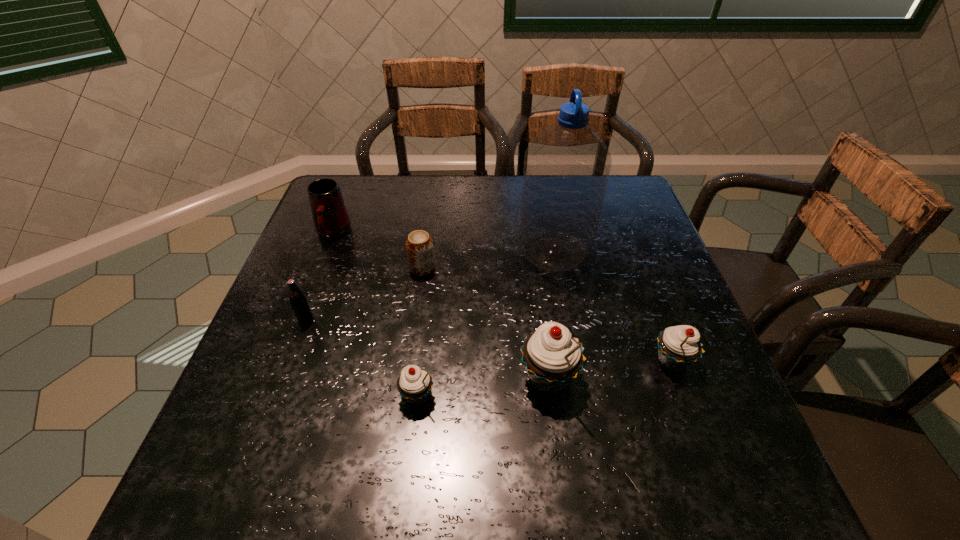
Please point a spot on the left to add another cupcake. Please provide its 2D coordinates. Your answer should be formatted as a tuple, i.e. [(x, y)], where the tuple contains the x and y coordinates of a point satisfying the conditions above.

[(276, 415)]